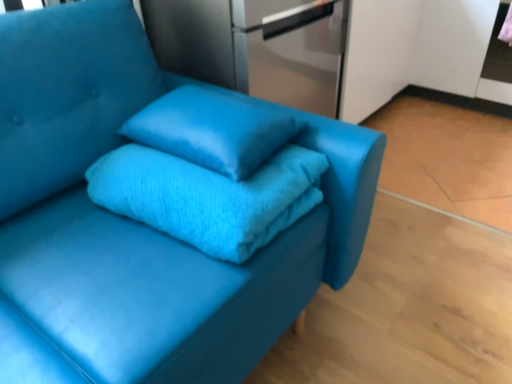
Question: Is the position of matte blue pillow at center less distant than that of turquoise fuzzy bath towel at center?

Choices:
 (A) yes
 (B) no

Answer: (B)

Question: From the image's perspective, is matte blue pillow at center above turquoise fuzzy bath towel at center?

Choices:
 (A) yes
 (B) no

Answer: (A)

Question: Does matte blue pillow at center turn towards turquoise fuzzy bath towel at center?

Choices:
 (A) no
 (B) yes

Answer: (A)

Question: Can turquoise fuzzy bath towel at center be found inside matte blue pillow at center?

Choices:
 (A) yes
 (B) no

Answer: (B)

Question: Considering the relative sizes of matte blue pillow at center and turquoise fuzzy bath towel at center in the image provided, is matte blue pillow at center thinner than turquoise fuzzy bath towel at center?

Choices:
 (A) no
 (B) yes

Answer: (B)

Question: Is matte blue pillow at center taller or shorter than satin silver refrigerator at upper center?

Choices:
 (A) short
 (B) tall

Answer: (A)

Question: Choose the correct answer: Is matte blue pillow at center inside satin silver refrigerator at upper center or outside it?

Choices:
 (A) inside
 (B) outside

Answer: (B)

Question: Is point (233, 127) closer or farther from the camera than point (331, 34)?

Choices:
 (A) farther
 (B) closer

Answer: (B)

Question: From a real-world perspective, is matte blue pillow at center above or below satin silver refrigerator at upper center?

Choices:
 (A) above
 (B) below

Answer: (A)

Question: Is satin silver refrigerator at upper center inside the boundaries of matte blue pillow at center, or outside?

Choices:
 (A) outside
 (B) inside

Answer: (A)

Question: Based on their positions, is satin silver refrigerator at upper center located to the left or right of matte blue pillow at center?

Choices:
 (A) right
 (B) left

Answer: (A)

Question: From a real-world perspective, is satin silver refrigerator at upper center above or below matte blue pillow at center?

Choices:
 (A) below
 (B) above

Answer: (A)

Question: In terms of height, does satin silver refrigerator at upper center look taller or shorter compared to matte blue pillow at center?

Choices:
 (A) short
 (B) tall

Answer: (B)

Question: Considering their positions, is turquoise fuzzy bath towel at center located in front of or behind satin silver refrigerator at upper center?

Choices:
 (A) behind
 (B) front

Answer: (B)

Question: In terms of height, does turquoise fuzzy bath towel at center look taller or shorter compared to satin silver refrigerator at upper center?

Choices:
 (A) tall
 (B) short

Answer: (B)